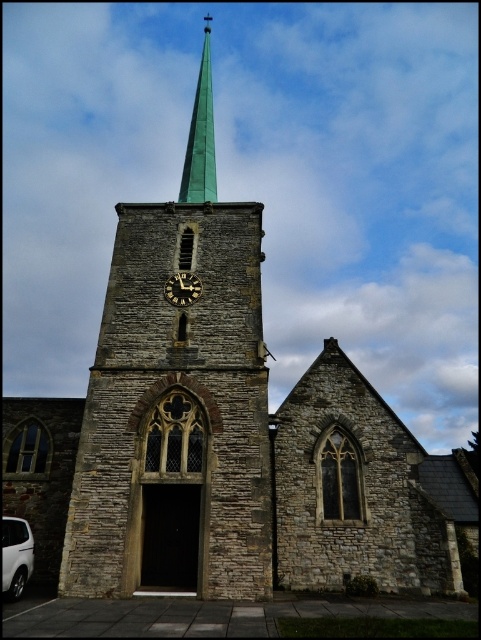
Which is more to the left, white matte van at lower left or gold metallic clock at center?

white matte van at lower left is more to the left.

Between white matte van at lower left and gold metallic clock at center, which one has less height?

Standing shorter between the two is white matte van at lower left.

At what (x,y) coordinates should I click in order to perform the action: click on white matte van at lower left. Please return your answer as a coordinate pair (x, y). The width and height of the screenshot is (481, 640). Looking at the image, I should click on (15, 556).

The height and width of the screenshot is (640, 481). Find the location of `white matte van at lower left`. white matte van at lower left is located at coordinates (15, 556).

Which is in front, point (211, 148) or point (2, 552)?

Point (2, 552)

Is green glass spire at upper center further to camera compared to white matte van at lower left?

Yes.

Is point (212, 195) positioned behind point (8, 518)?

Yes, it is behind point (8, 518).

At what (x,y) coordinates should I click in order to perform the action: click on green glass spire at upper center. Please return your answer as a coordinate pair (x, y). The image size is (481, 640). Looking at the image, I should click on (201, 136).

Who is taller, green glass spire at upper center or gold metallic clock at center?

green glass spire at upper center

Who is more distant from viewer, (184, 195) or (185, 284)?

The point (184, 195) is more distant.

In order to click on green glass spire at upper center in this screenshot , I will do `click(201, 136)`.

Locate an element on the screen. This screenshot has width=481, height=640. green glass spire at upper center is located at coordinates (201, 136).